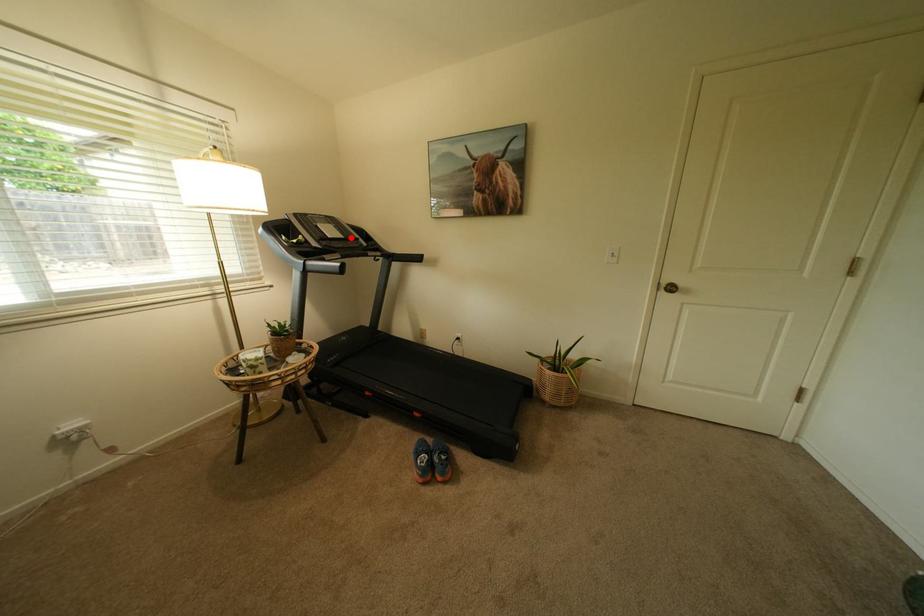
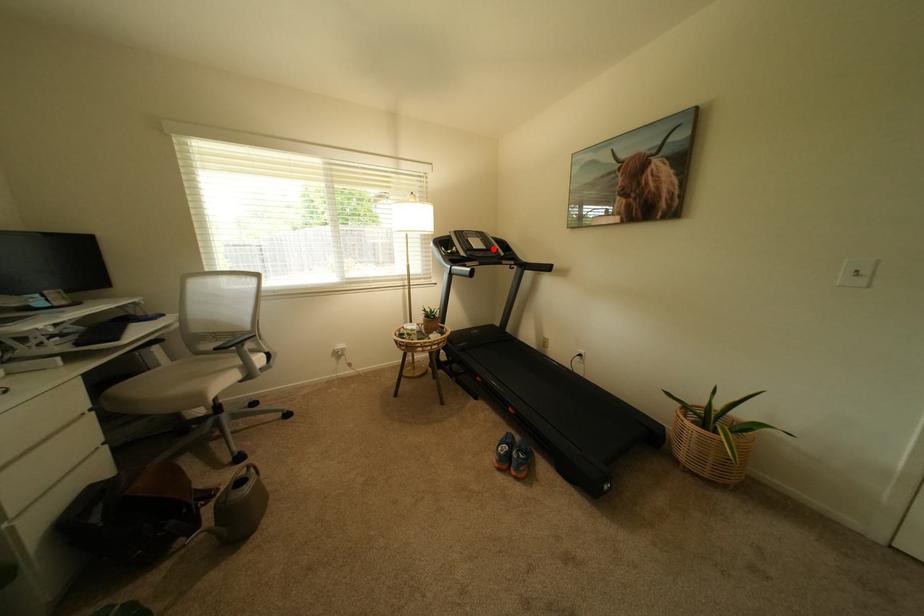
I am providing you with two images of the same scene from different viewpoints. A red point is marked on the first image and another point is marked on the second image. Are the points marked in image1 and image2 representing the same 3D position?

Yes